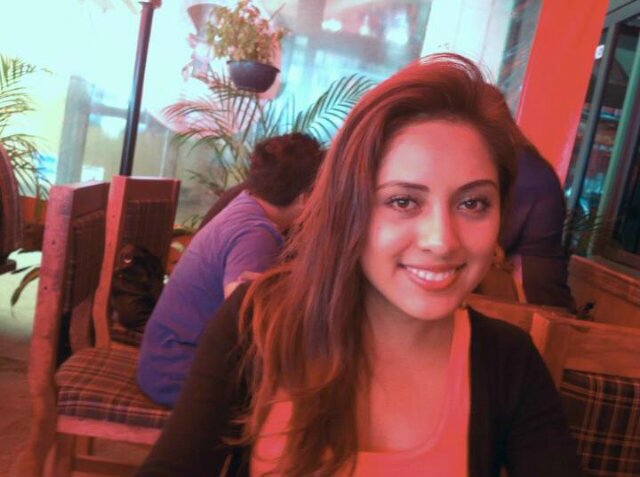
Where is `chairs`? chairs is located at coordinates (92, 392), (148, 227).